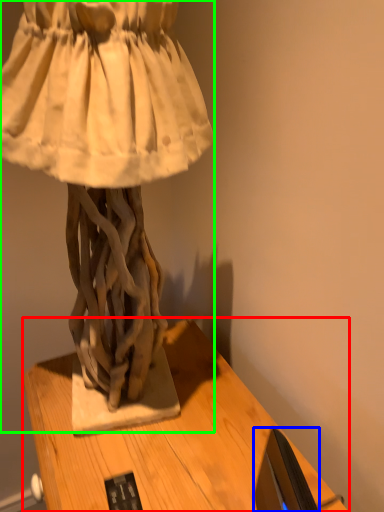
Question: Estimate the real-world distances between objects in this image. Which object is farther from table (highlighted by a red box), computer monitor (highlighted by a blue box) or sculpture (highlighted by a green box)?

Choices:
 (A) computer monitor
 (B) sculpture

Answer: (B)